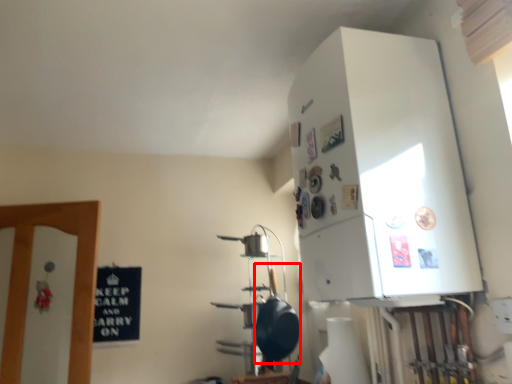
Question: Observing the image, what is the correct spatial positioning of wok (annotated by the red box) in reference to appliance?

Choices:
 (A) left
 (B) right

Answer: (A)